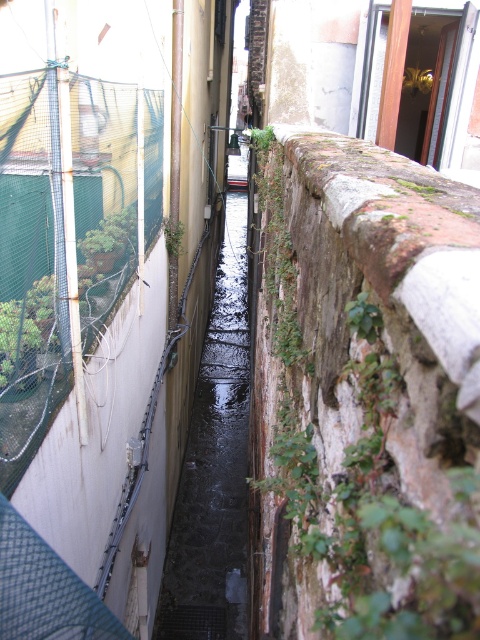
You are a delivery drone flying above the alleyway. You need to land precisely on the black concrete water at center. What are the coordinates where you should aim to land?

The coordinates for the black concrete water at center are (x=214, y=467). You should aim to land there.

You are standing in the alleyway described. You need to cross the alley to the other side. The black concrete water at center is in your way. Can you step over it?

The black concrete water at center is located at point (214, 467), which is in the center of the alleyway. Since it is a narrow alleyway, stepping over it may be possible if the water channel is not too wide. However, the description mentions it is a small water channel, so it is likely manageable to step over.